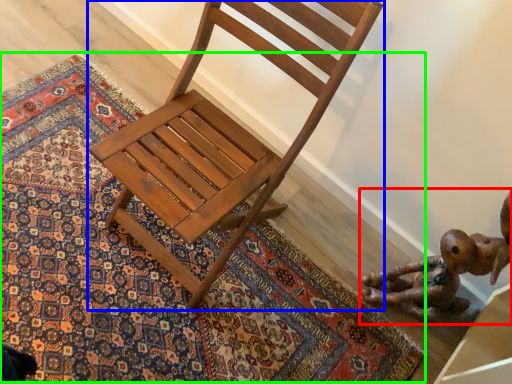
Question: Based on their relative distances, which object is farther from toy (highlighted by a red box)? Choose from chair (highlighted by a blue box) and mat (highlighted by a green box).

Choices:
 (A) chair
 (B) mat

Answer: (A)